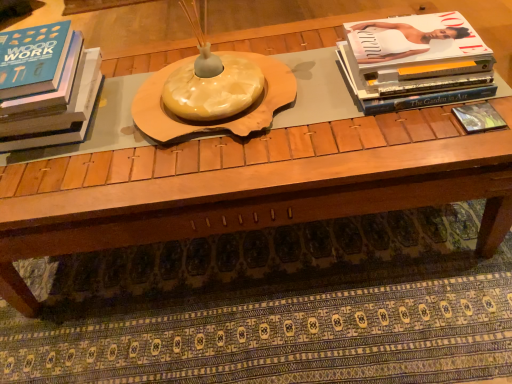
Question: Choose the correct answer: Is matte black book at right, the first book in the right-to-left sequence, inside matte black book at left, which appears as the third book when viewed from the right, or outside it?

Choices:
 (A) inside
 (B) outside

Answer: (B)

Question: Is matte black book at right, marked as the third book in a left-to-right arrangement, to the left or to the right of matte black book at left, which appears as the third book when viewed from the right, in the image?

Choices:
 (A) right
 (B) left

Answer: (A)

Question: Which object is the closest to the matte white book at upper right, the second book positioned from the left?

Choices:
 (A) matte black book at right, marked as the third book in a left-to-right arrangement
 (B) matte black book at left, acting as the 1th book starting from the left

Answer: (A)

Question: Considering the real-world distances, which object is farthest from the matte black book at right, the first book in the right-to-left sequence?

Choices:
 (A) matte white book at upper right, the 2th book when ordered from right to left
 (B) matte black book at left, which appears as the third book when viewed from the right

Answer: (B)